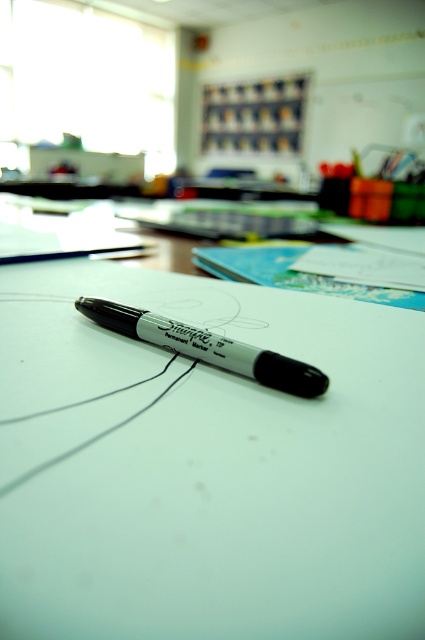
Question: Which point is farther to the camera?

Choices:
 (A) white paper at center
 (B) black marker pen at center

Answer: (B)

Question: Does white paper at center have a larger size compared to black marker pen at center?

Choices:
 (A) yes
 (B) no

Answer: (A)

Question: Which object is closer to the camera taking this photo?

Choices:
 (A) white paper at center
 (B) black marker pen at center

Answer: (A)

Question: Which point is closer to the camera taking this photo?

Choices:
 (A) (181, 561)
 (B) (136, 308)

Answer: (A)

Question: Is white paper at center above black marker pen at center?

Choices:
 (A) no
 (B) yes

Answer: (B)

Question: Does white paper at center appear on the left side of black marker pen at center?

Choices:
 (A) no
 (B) yes

Answer: (A)